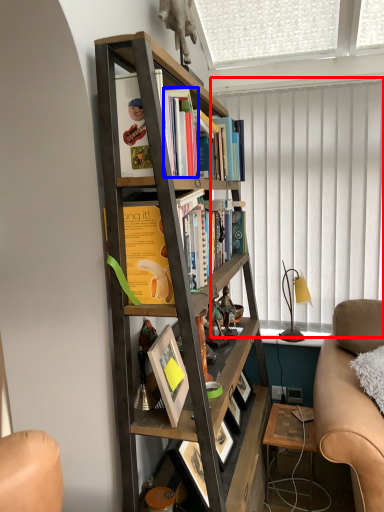
Question: Which object appears farthest to the camera in this image, curtain (highlighted by a red box) or book (highlighted by a blue box)?

Choices:
 (A) curtain
 (B) book

Answer: (A)